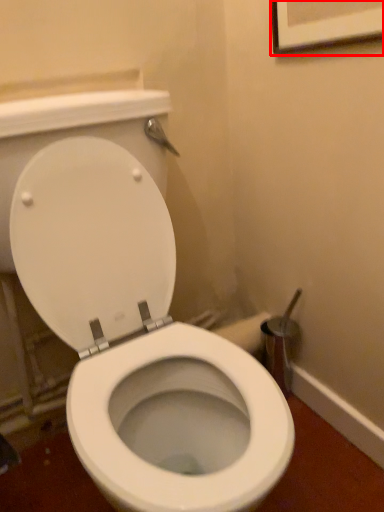
Question: Where is picture frame (annotated by the red box) located in relation to toilet in the image?

Choices:
 (A) left
 (B) right

Answer: (B)